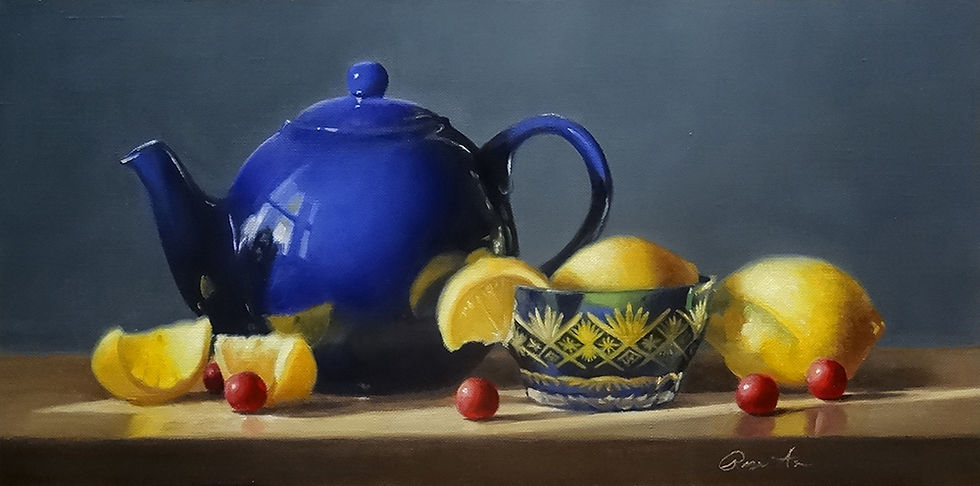
Locate an element on the screen. The image size is (980, 486). blue teapot lid on top of teapot is located at coordinates (379, 115).